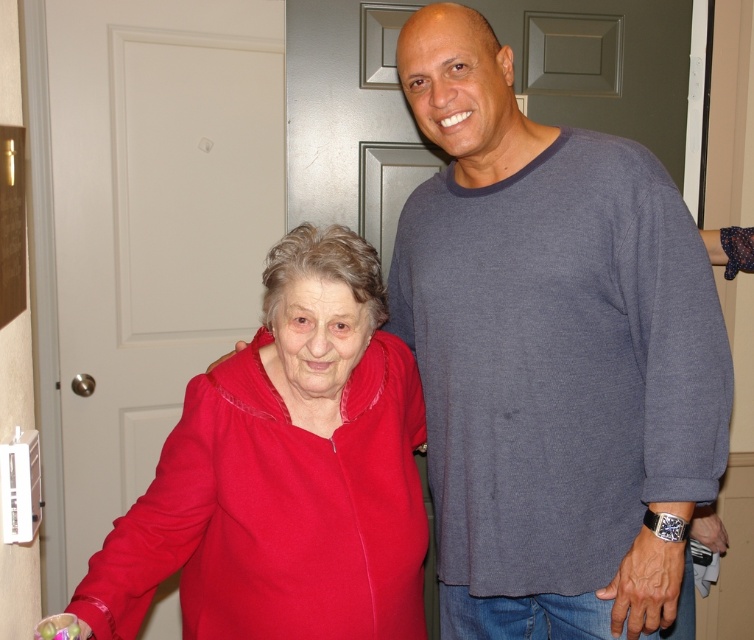
Does gray cotton shirt at right have a greater height compared to matte red sweater at left?

Correct, gray cotton shirt at right is much taller as matte red sweater at left.

Who is higher up, gray cotton shirt at right or matte red sweater at left?

gray cotton shirt at right

Identify the location of gray cotton shirt at right. The width and height of the screenshot is (754, 640). (550, 355).